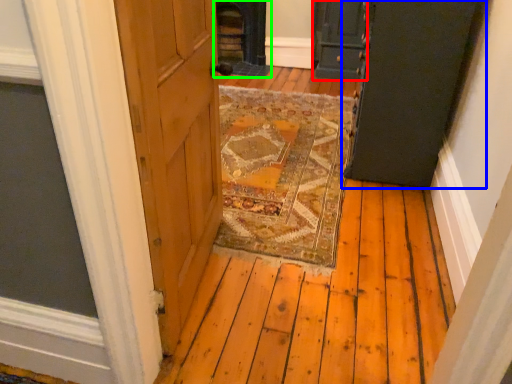
Question: Based on their relative distances, which object is nearer to door (highlighted by a red box)? Choose from door (highlighted by a blue box) and fireplace (highlighted by a green box).

Choices:
 (A) door
 (B) fireplace

Answer: (B)